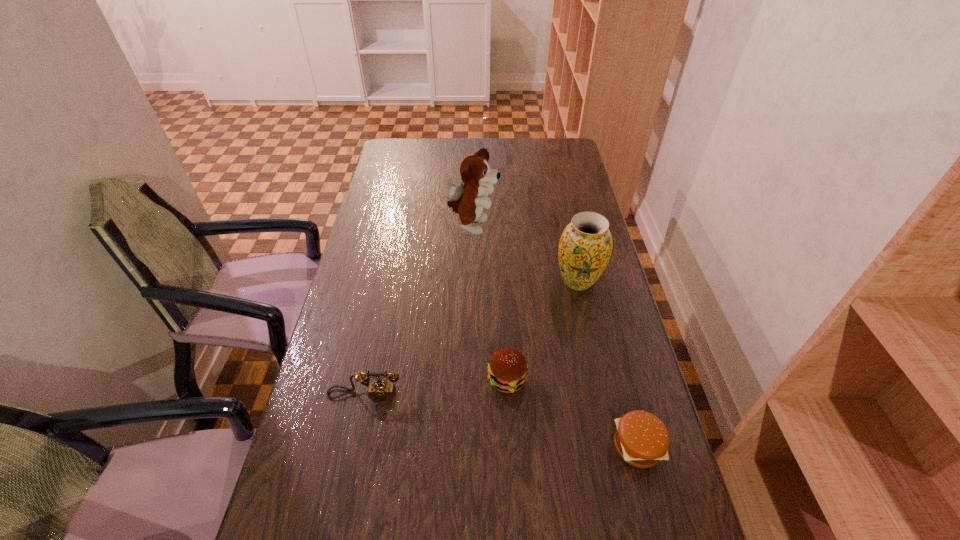
Where is `the tallest object`? the tallest object is located at coordinates (468, 200).

Locate an element on the screen. the farthest object is located at coordinates point(468,200).

At what (x,y) coordinates should I click in order to perform the action: click on vase. Please return your answer as a coordinate pair (x, y). Image resolution: width=960 pixels, height=540 pixels. Looking at the image, I should click on [x=585, y=247].

Identify the location of the second farthest object. (585, 247).

Locate an element on the screen. the left hamburger is located at coordinates (507, 371).

At what (x,y) coordinates should I click in order to perform the action: click on the taller hamburger. Please return your answer as a coordinate pair (x, y). Looking at the image, I should click on (507, 371).

The image size is (960, 540). In order to click on telephone in this screenshot , I will do `click(380, 390)`.

At what (x,y) coordinates should I click in order to perform the action: click on the nearer hamburger. Please return your answer as a coordinate pair (x, y). Looking at the image, I should click on (641, 439).

The height and width of the screenshot is (540, 960). I want to click on the shortest object, so click(x=641, y=439).

The height and width of the screenshot is (540, 960). I want to click on vacant region located 0.130m on the face of the farthest object, so click(534, 227).